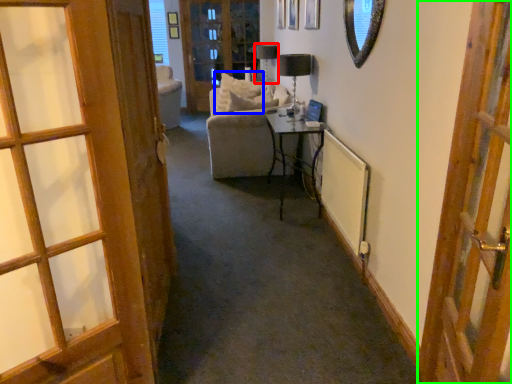
Question: Which is farther away from table lamp (highlighted by a red box)? pillow (highlighted by a blue box) or door (highlighted by a green box)?

Choices:
 (A) pillow
 (B) door

Answer: (B)